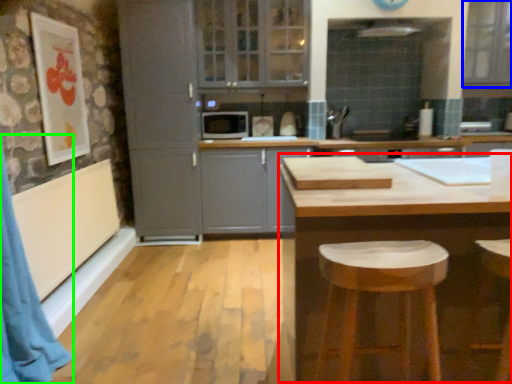
Question: Based on their relative distances, which object is farther from table (highlighted by a red box)? Choose from window (highlighted by a blue box) and curtain (highlighted by a green box).

Choices:
 (A) window
 (B) curtain

Answer: (A)